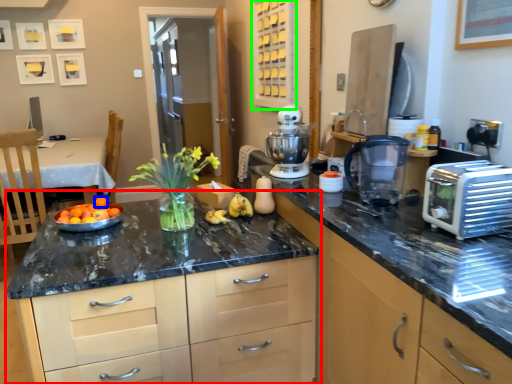
Question: Considering the real-world distances, which object is closest to cabinetry (highlighted by a red box)? orange (highlighted by a blue box) or cabinetry (highlighted by a green box).

Choices:
 (A) orange
 (B) cabinetry

Answer: (A)